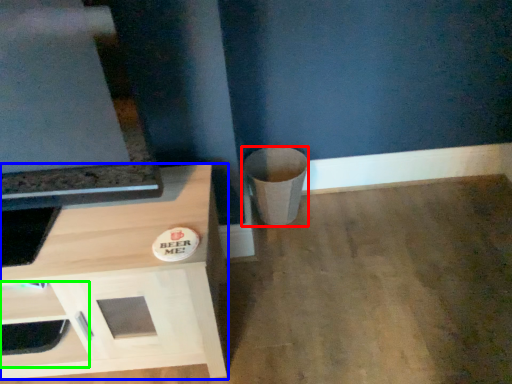
Question: Considering the real-world distances, which object is closest to trash bin/can (highlighted by a red box)? cabinetry (highlighted by a blue box) or drawer (highlighted by a green box).

Choices:
 (A) cabinetry
 (B) drawer

Answer: (A)